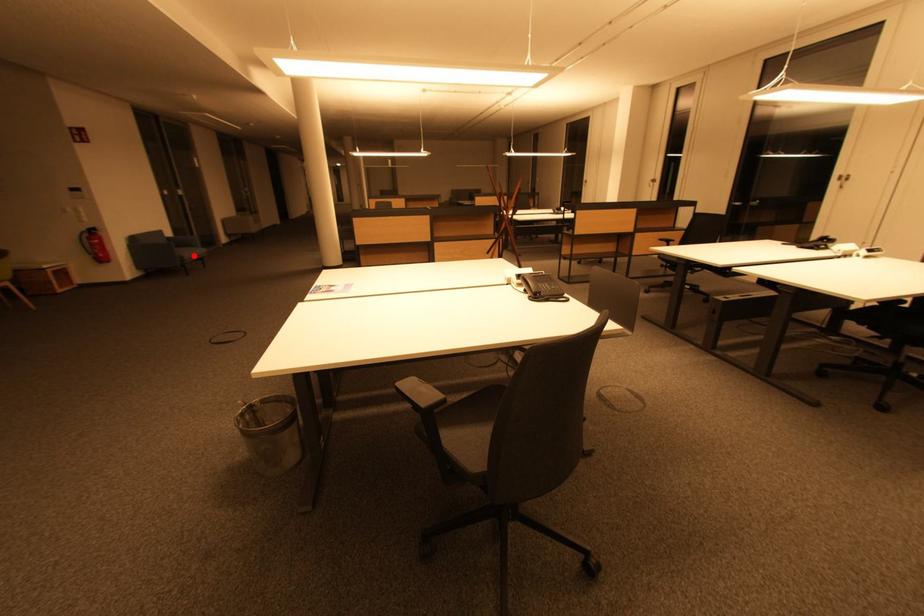
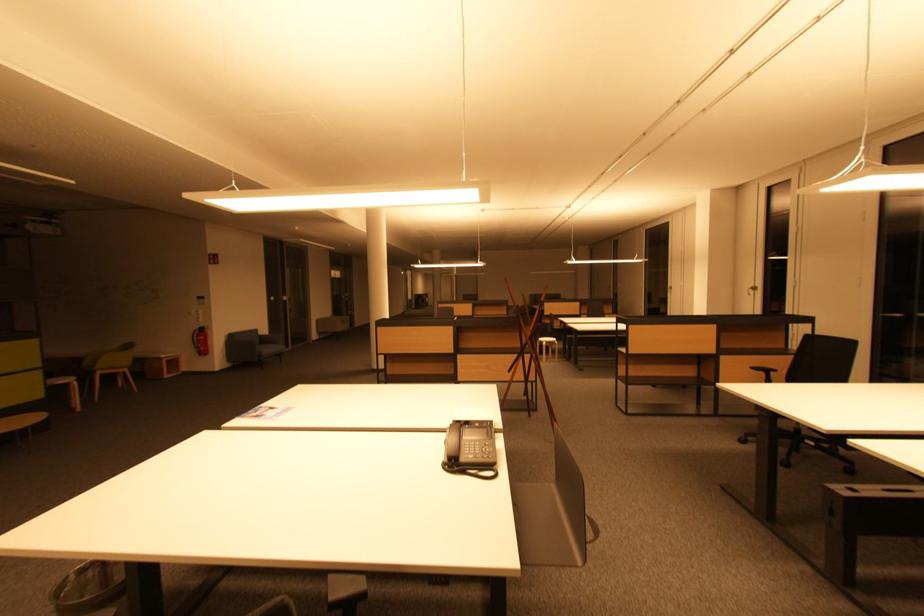
Locate, in the second image, the point that corresponds to the highlighted location in the first image.

(272, 352)